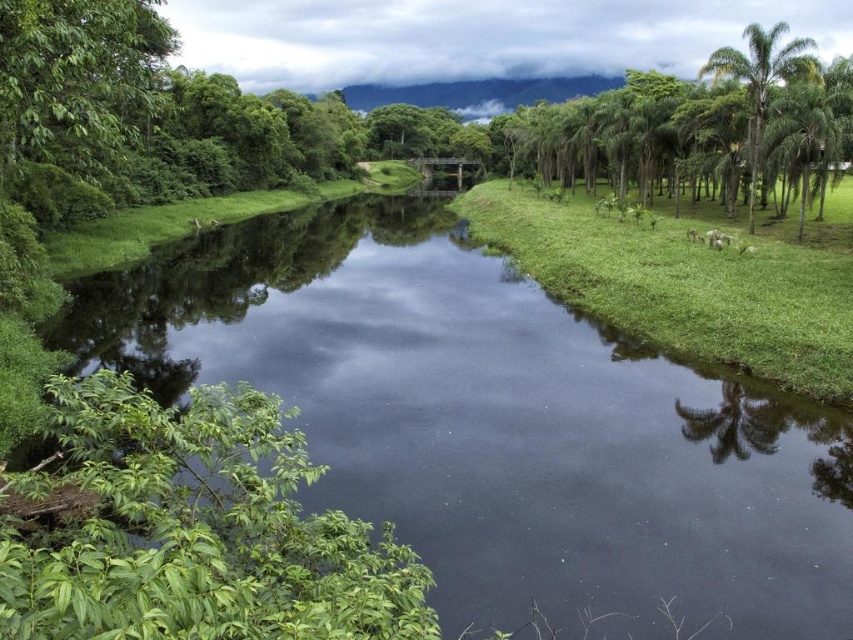
Question: Which of the following is the farthest from the observer?

Choices:
 (A) 781,68
 (B) 672,401
 (C) 782,150
 (D) 602,312

Answer: (A)

Question: Can you confirm if green grassy at right is bigger than green leafy palm tree at upper right?

Choices:
 (A) yes
 (B) no

Answer: (A)

Question: Among these points, which one is farthest from the camera?

Choices:
 (A) (616, 532)
 (B) (804, 122)
 (C) (730, 349)

Answer: (B)

Question: Is the position of green grassy at right more distant than that of green leafy palm tree at right?

Choices:
 (A) yes
 (B) no

Answer: (B)

Question: Is green grassy stream at center positioned in front of green grassy at right?

Choices:
 (A) yes
 (B) no

Answer: (A)

Question: Which object is closer to the camera taking this photo?

Choices:
 (A) green leafy palm tree at right
 (B) green grassy at right
 (C) green grassy stream at center

Answer: (C)